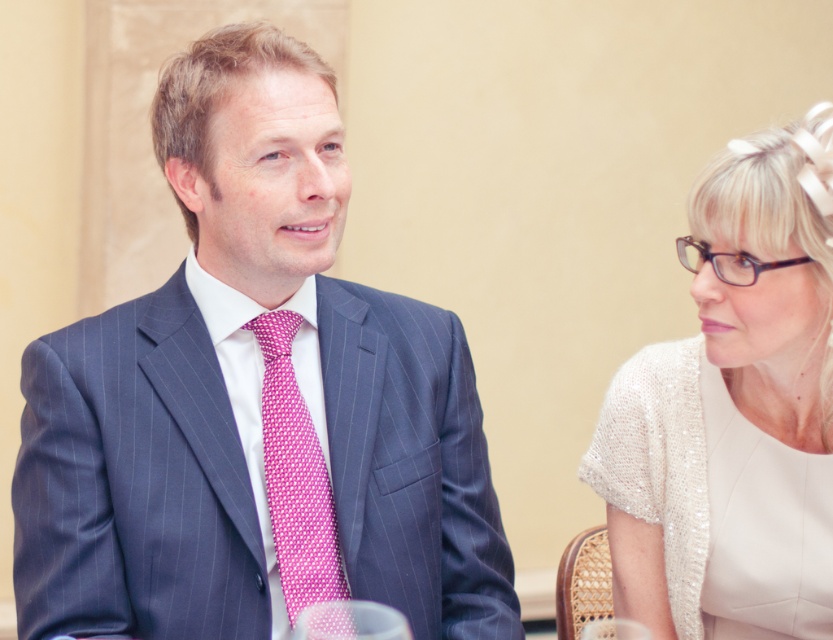
Question: Observing the image, what is the correct spatial positioning of sequined beige dress at right in reference to pink dotted fabric tie at center?

Choices:
 (A) above
 (B) below

Answer: (A)

Question: Which point appears closest to the camera in this image?

Choices:
 (A) (292, 480)
 (B) (651, 484)

Answer: (A)

Question: Can you confirm if sequined beige dress at right is thinner than pink dotted fabric tie at center?

Choices:
 (A) no
 (B) yes

Answer: (A)

Question: Considering the real-world distances, which object is closest to the sequined beige dress at right?

Choices:
 (A) blue pinstripe suit at left
 (B) pink dotted fabric tie at center

Answer: (A)

Question: From the image, what is the correct spatial relationship of blue pinstripe suit at left in relation to pink dotted fabric tie at center?

Choices:
 (A) right
 (B) left

Answer: (B)

Question: Which object is positioned farthest from the pink dotted fabric tie at center?

Choices:
 (A) blue pinstripe suit at left
 (B) sequined beige dress at right

Answer: (B)